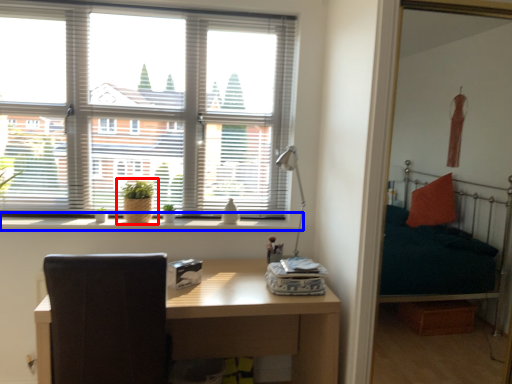
Question: Which object is further to the camera taking this photo, houseplant (highlighted by a red box) or window sill (highlighted by a blue box)?

Choices:
 (A) houseplant
 (B) window sill

Answer: (A)